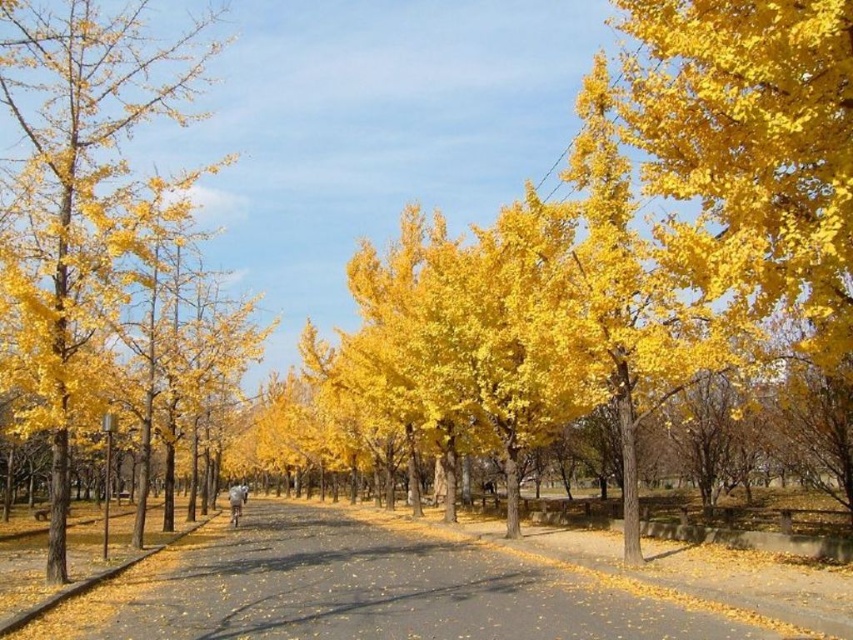
Based on the photo, how far apart are yellow asphalt road at center and yellow leafy tree at left?

The distance of yellow asphalt road at center from yellow leafy tree at left is 7.72 meters.

Who is lower down, yellow asphalt road at center or yellow leafy tree at left?

Positioned lower is yellow asphalt road at center.

Which is behind, point (358, 605) or point (184, 38)?

The point (184, 38) is behind.

You are a GUI agent. You are given a task and a screenshot of the screen. Output one action in this format:
    pyautogui.click(x=<x>, y=<y>)
    Task: Click on the yellow asphalt road at center
    
    Given the screenshot: What is the action you would take?
    pyautogui.click(x=378, y=593)